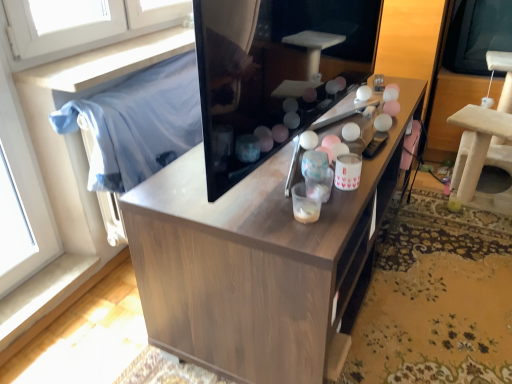
Question: Is the position of transparent plastic window screen at upper right less distant than that of beige carpeted cat tree at right?

Choices:
 (A) no
 (B) yes

Answer: (A)

Question: From the image's perspective, is transparent plastic window screen at upper right under beige carpeted cat tree at right?

Choices:
 (A) no
 (B) yes

Answer: (A)

Question: Considering the relative sizes of transparent plastic window screen at upper right and beige carpeted cat tree at right in the image provided, is transparent plastic window screen at upper right shorter than beige carpeted cat tree at right?

Choices:
 (A) yes
 (B) no

Answer: (A)

Question: Is transparent plastic window screen at upper right aimed at beige carpeted cat tree at right?

Choices:
 (A) yes
 (B) no

Answer: (B)

Question: Can you confirm if transparent plastic window screen at upper right is wider than beige carpeted cat tree at right?

Choices:
 (A) yes
 (B) no

Answer: (B)

Question: Considering the relative sizes of transparent plastic window screen at upper right and beige carpeted cat tree at right in the image provided, is transparent plastic window screen at upper right thinner than beige carpeted cat tree at right?

Choices:
 (A) yes
 (B) no

Answer: (A)

Question: From the image's perspective, is transparent plastic window screen at upper right above wooden cabinet at center?

Choices:
 (A) no
 (B) yes

Answer: (B)

Question: Does transparent plastic window screen at upper right appear on the left side of wooden cabinet at center?

Choices:
 (A) no
 (B) yes

Answer: (A)

Question: Is transparent plastic window screen at upper right facing towards wooden cabinet at center?

Choices:
 (A) no
 (B) yes

Answer: (B)

Question: Is transparent plastic window screen at upper right positioned behind wooden cabinet at center?

Choices:
 (A) no
 (B) yes

Answer: (B)

Question: Is wooden cabinet at center at the back of transparent plastic window screen at upper right?

Choices:
 (A) yes
 (B) no

Answer: (B)

Question: Are transparent plastic window screen at upper right and wooden cabinet at center located far from each other?

Choices:
 (A) yes
 (B) no

Answer: (A)

Question: Is wooden cabinet at center aimed at beige carpeted cat tree at right?

Choices:
 (A) yes
 (B) no

Answer: (A)